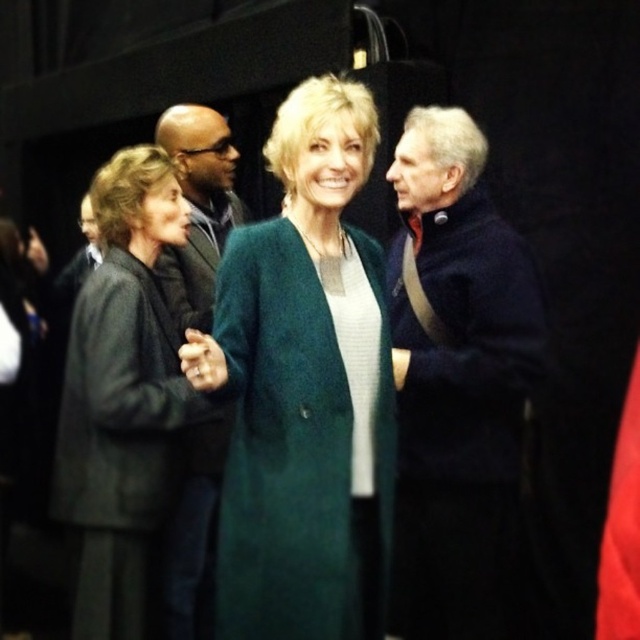
You are a photographer at the event and need to adjust the camera settings to capture both the dark gray wool coat at left and the matte black coat at center clearly. Since the camera has a limited focus range, which coat should you prioritize focusing on to ensure both are in focus, considering their sizes?

Answer: The dark gray wool coat at left is wider than the matte black coat at center. Therefore, focusing on the wider dark gray wool coat at left would help ensure both are within the focus range.

From the picture: You are organizing a photo shoot and need to place two props next to the dark blue sweater at right and the matte black coat at center. If the props are the same size, will they fit equally well next to both objects?

The dark blue sweater at right is wider than the matte black coat at center. Therefore, the props placed next to the dark blue sweater at right will have more space around them compared to those next to the matte black coat at center.

You are standing in the middle of the gathering and want to take a photo. There are two points of interest marked as point (388, 269) and point (182, 292). Which point is closer to your camera lens?

Point (388, 269) is closer to the camera than point (182, 292), so it will appear larger in your photo.